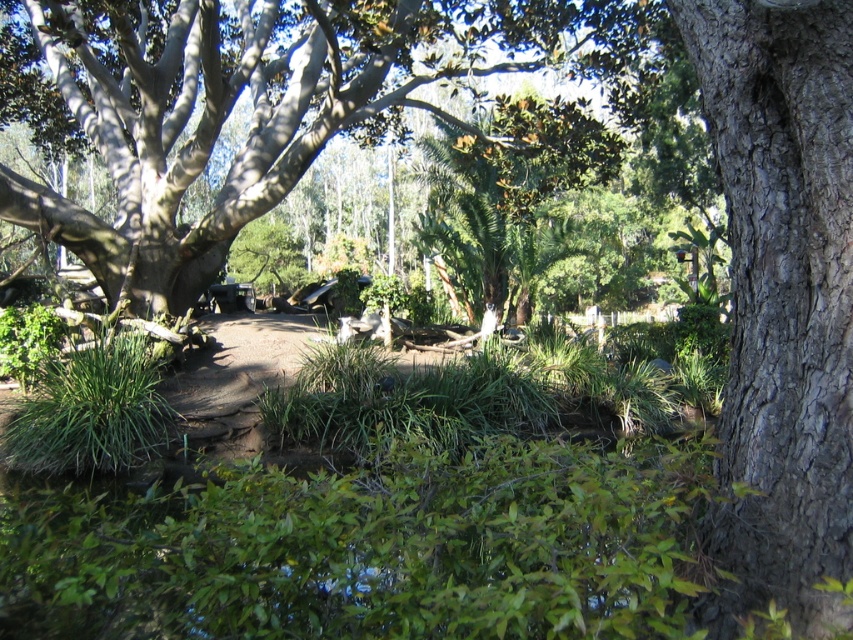
Question: Is smooth gray bark tree at upper left below gray textured bark tree at right?

Choices:
 (A) no
 (B) yes

Answer: (A)

Question: Which point is closer to the camera taking this photo?

Choices:
 (A) (247, 170)
 (B) (743, 166)

Answer: (B)

Question: Which object is farther from the camera taking this photo?

Choices:
 (A) gray textured bark tree at right
 (B) smooth gray bark tree at upper left

Answer: (B)

Question: Does smooth gray bark tree at upper left appear on the right side of gray textured bark tree at right?

Choices:
 (A) yes
 (B) no

Answer: (B)

Question: Can you confirm if smooth gray bark tree at upper left is positioned above gray textured bark tree at right?

Choices:
 (A) yes
 (B) no

Answer: (A)